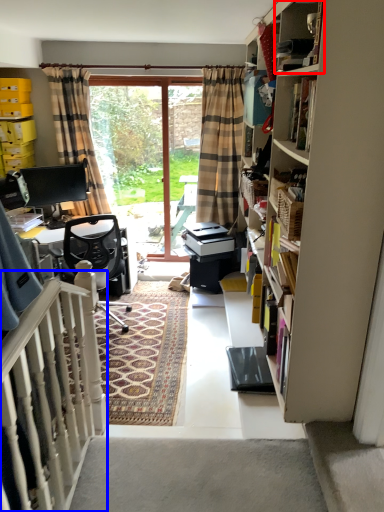
Question: Which point is further to the camera, cabinet (highlighted by a red box) or balustrade (highlighted by a blue box)?

Choices:
 (A) cabinet
 (B) balustrade

Answer: (A)